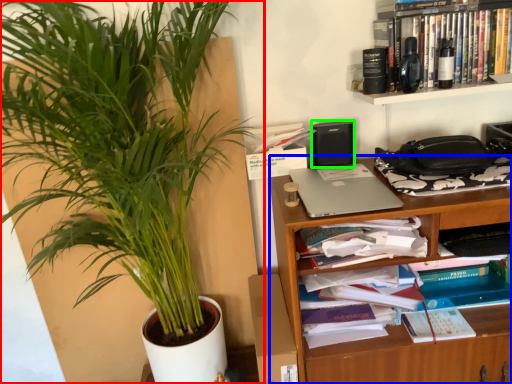
Question: Which object is the farthest from houseplant (highlighted by a red box)? Choose among these: shelf (highlighted by a blue box) or speaker (highlighted by a green box).

Choices:
 (A) shelf
 (B) speaker

Answer: (B)